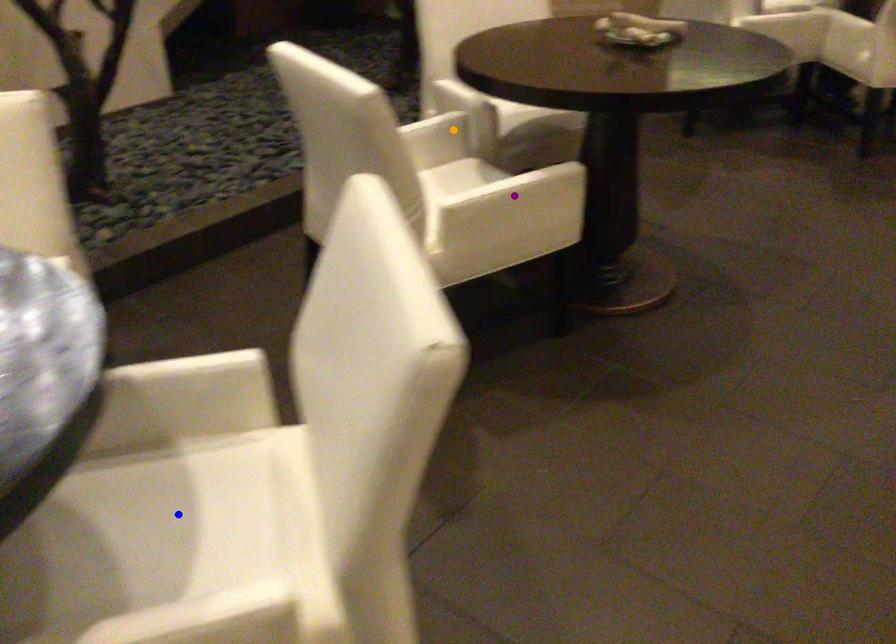
Order these from nearest to farthest:
blue point
orange point
purple point

blue point
purple point
orange point